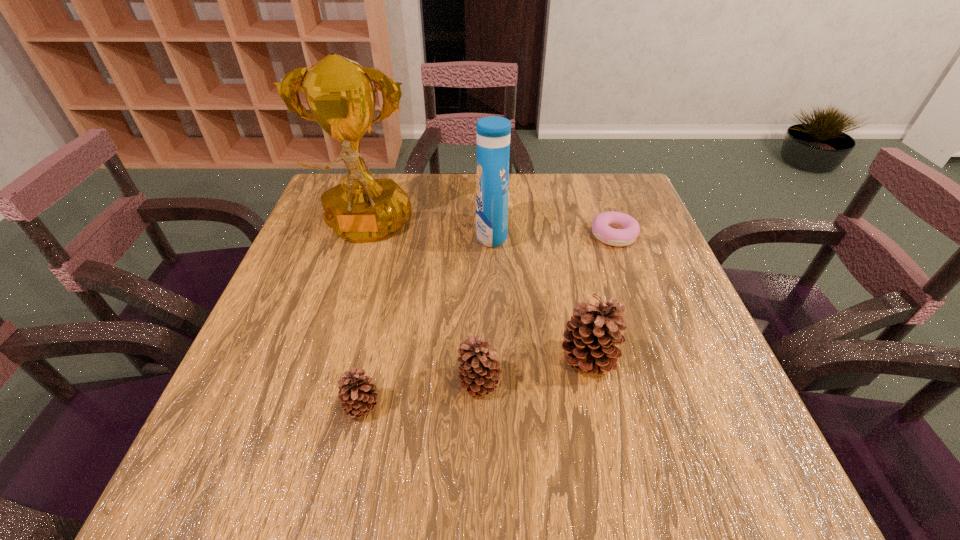
Considering the uniform spacing of pinecones, where should an additional pinecone be positioned on the right? Please locate a free spot. Please provide its 2D coordinates. Your answer should be formatted as a tuple, i.e. [(x, y)], where the tuple contains the x and y coordinates of a point satisfying the conditions above.

[(685, 339)]